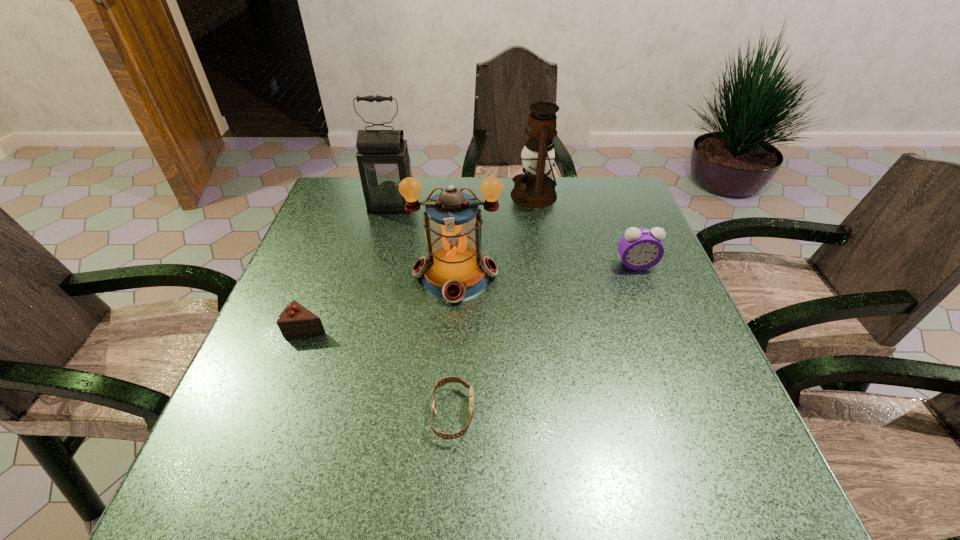
Locate an element on the screen. free space between the second lantern from left to right and the shortest object is located at coordinates (454, 345).

Locate an element on the screen. The width and height of the screenshot is (960, 540). vacant space that's between the rightmost lantern and the shortest object is located at coordinates (493, 304).

Identify the location of empty space that is in between the shortest lantern and the rightmost lantern. (494, 235).

Image resolution: width=960 pixels, height=540 pixels. Identify the location of free spot between the alarm clock and the fifth object from left to right. (585, 230).

Locate which object ranks second in proximity to the alarm clock. Please provide its 2D coordinates. Your answer should be formatted as a tuple, i.e. [(x, y)], where the tuple contains the x and y coordinates of a point satisfying the conditions above.

[(455, 269)]

Where is `object that is the nearest to the leftmost lantern`? This screenshot has width=960, height=540. object that is the nearest to the leftmost lantern is located at coordinates (455, 269).

Locate an element on the screen. This screenshot has height=540, width=960. lantern that is the second closest to the nearest lantern is located at coordinates (534, 189).

You are a GUI agent. You are given a task and a screenshot of the screen. Output one action in this format:
    pyautogui.click(x=<x>, y=<y>)
    Task: Click on the lantern that is the third nearest to the second shortest object
    
    Given the screenshot: What is the action you would take?
    pyautogui.click(x=534, y=189)

I want to click on free space that satisfies the following two spatial constraints: 1. on the face of the fourth tallest object; 2. on the face of the nearest object, so click(694, 414).

Locate an element on the screen. This screenshot has width=960, height=540. free spot that satisfies the following two spatial constraints: 1. on the side of the rightmost lantern, there is a wick adjustment knob; 2. on the front-facing side of the leftmost lantern is located at coordinates (536, 204).